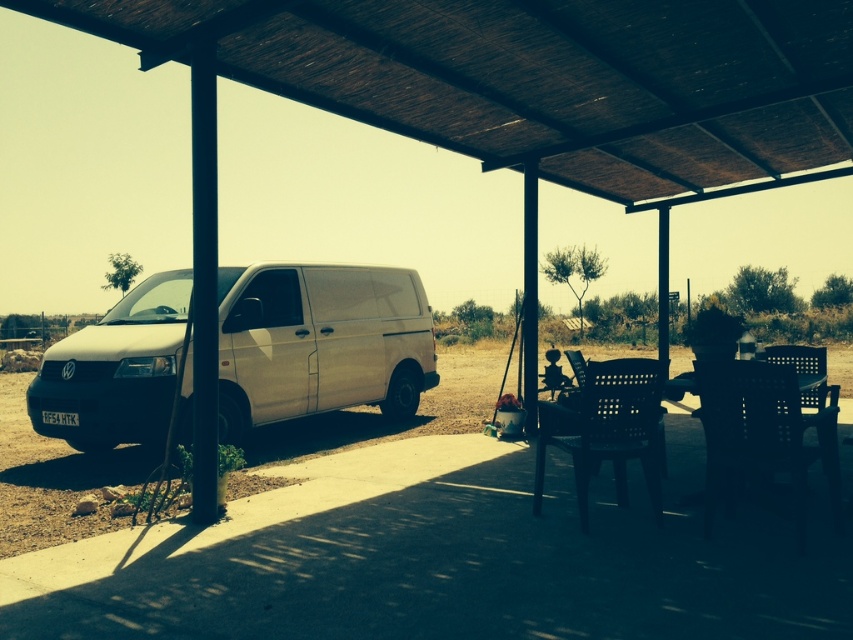
Question: Is white matte van at left to the right of black plastic picnic table at lower right from the viewer's perspective?

Choices:
 (A) no
 (B) yes

Answer: (A)

Question: Is white matte van at left thinner than dirt field at lower left?

Choices:
 (A) yes
 (B) no

Answer: (A)

Question: Considering the real-world distances, which object is closest to the dirt field at lower left?

Choices:
 (A) white matte van at left
 (B) black plastic picnic table at lower right
 (C) black plastic chair at center

Answer: (C)

Question: Can you confirm if white matte van at left is thinner than black plastic picnic table at lower right?

Choices:
 (A) yes
 (B) no

Answer: (B)

Question: Which point appears closest to the camera in this image?

Choices:
 (A) (780, 408)
 (B) (462, 400)
 (C) (660, 470)
 (D) (628, 452)

Answer: (A)

Question: Which of these objects is positioned farthest from the white matte van at left?

Choices:
 (A) black plastic chair at center
 (B) black plastic picnic table at lower right

Answer: (A)